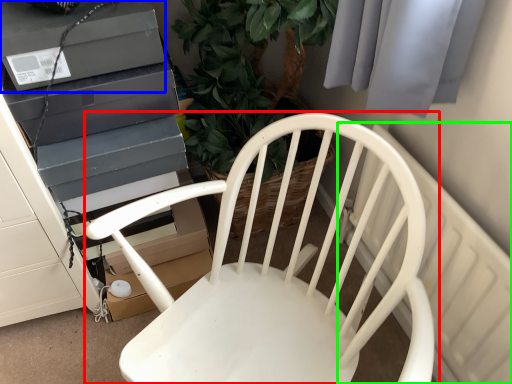
Question: Which object is the closest to the chair (highlighted by a red box)? Choose among these: appliance (highlighted by a blue box) or radiator (highlighted by a green box).

Choices:
 (A) appliance
 (B) radiator

Answer: (B)